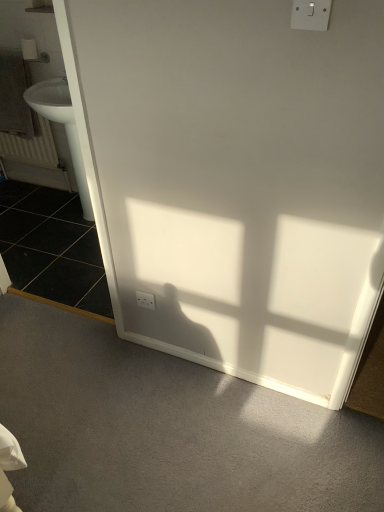
Question: From the image's perspective, does white matte toilet paper at upper left appear higher than white plastic electric outlet at lower left, the second electric outlet when ordered from top to bottom?

Choices:
 (A) yes
 (B) no

Answer: (A)

Question: Is white matte toilet paper at upper left to the right of white plastic electric outlet at lower left, which is counted as the first electric outlet, starting from the bottom, from the viewer's perspective?

Choices:
 (A) yes
 (B) no

Answer: (B)

Question: Is white plastic electric outlet at lower left, which is counted as the first electric outlet, starting from the bottom, at the back of white matte toilet paper at upper left?

Choices:
 (A) no
 (B) yes

Answer: (A)

Question: Is white matte toilet paper at upper left thinner than white plastic electric outlet at lower left, acting as the 2th electric outlet starting from the front?

Choices:
 (A) no
 (B) yes

Answer: (A)

Question: Is white matte toilet paper at upper left not near white plastic electric outlet at lower left, which is the 1th electric outlet from back to front?

Choices:
 (A) no
 (B) yes

Answer: (B)

Question: From a real-world perspective, is white matte radiator at left above or below black tile at left?

Choices:
 (A) below
 (B) above

Answer: (B)

Question: In the image, is white matte radiator at left positioned in front of or behind black tile at left?

Choices:
 (A) front
 (B) behind

Answer: (B)

Question: Is white matte radiator at left spatially inside black tile at left, or outside of it?

Choices:
 (A) outside
 (B) inside

Answer: (A)

Question: In terms of size, does white matte radiator at left appear bigger or smaller than black tile at left?

Choices:
 (A) small
 (B) big

Answer: (A)

Question: Is white plastic switch at upper right, which appears as the 2th electric outlet when viewed from the left, wider or thinner than black tile at left?

Choices:
 (A) wide
 (B) thin

Answer: (B)

Question: In terms of height, does white plastic switch at upper right, the second electric outlet viewed from the back, look taller or shorter compared to black tile at left?

Choices:
 (A) short
 (B) tall

Answer: (B)

Question: Considering their positions, is white plastic switch at upper right, the second electric outlet viewed from the back, located in front of or behind black tile at left?

Choices:
 (A) front
 (B) behind

Answer: (A)

Question: From a real-world perspective, relative to black tile at left, is white plastic switch at upper right, which is the second electric outlet in bottom-to-top order, vertically above or below?

Choices:
 (A) below
 (B) above

Answer: (B)

Question: From a real-world perspective, is gray textured towel at left positioned above or below white plastic switch at upper right, which is the second electric outlet in bottom-to-top order?

Choices:
 (A) below
 (B) above

Answer: (A)

Question: Considering the positions of gray textured towel at left and white plastic switch at upper right, acting as the first electric outlet starting from the right, in the image, is gray textured towel at left wider or thinner than white plastic switch at upper right, acting as the first electric outlet starting from the right,?

Choices:
 (A) wide
 (B) thin

Answer: (A)